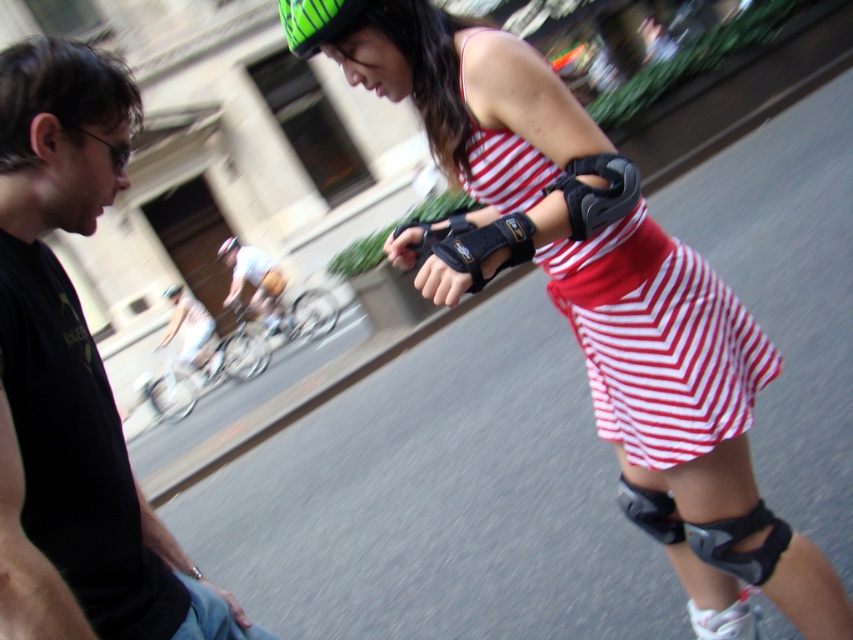
You are a photographer trying to capture the exact location of the point at coordinates (316, 20) in the image. Based on the scene description, can you identify which object this point is located on?

The point at coordinates (316, 20) is located on the green striped helmet at upper center.

You are a photographer trying to capture the perfect shot of the matte black elbow pads at center and the green matte helmet at upper center. Based on their positions, which object should you adjust your camera focus to first to ensure both are in frame?

The matte black elbow pads at center are to the right of the green matte helmet at upper center, so you should focus on the green matte helmet at upper center first to ensure both are in frame.